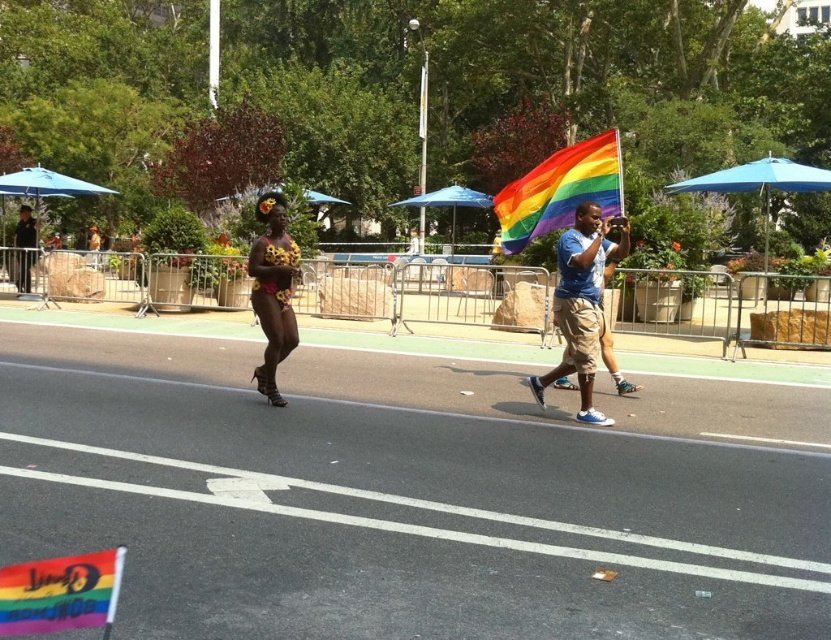
You are a photographer trying to capture both the blue fabric umbrella at center and the rainbow fabric umbrella at upper center in a single shot. Which umbrella will appear larger in the photo?

The blue fabric umbrella at center will appear larger in the photo because it is larger in size than the rainbow fabric umbrella at upper center.

You are at a parade and want to take a photo of both the blue fabric umbrella at center and the rainbow fabric umbrella at upper center. Which umbrella should you focus on first to ensure both are in the frame?

You should focus on the blue fabric umbrella at center first because it is located below the rainbow fabric umbrella at upper center, so adjusting the camera angle to include both would require framing from the lower to upper positions.

Based on the coordinates provided, where is the blue cotton shirt at center located in the image?

The blue cotton shirt at center is located at the 2D coordinates point (581, 304) in the image.